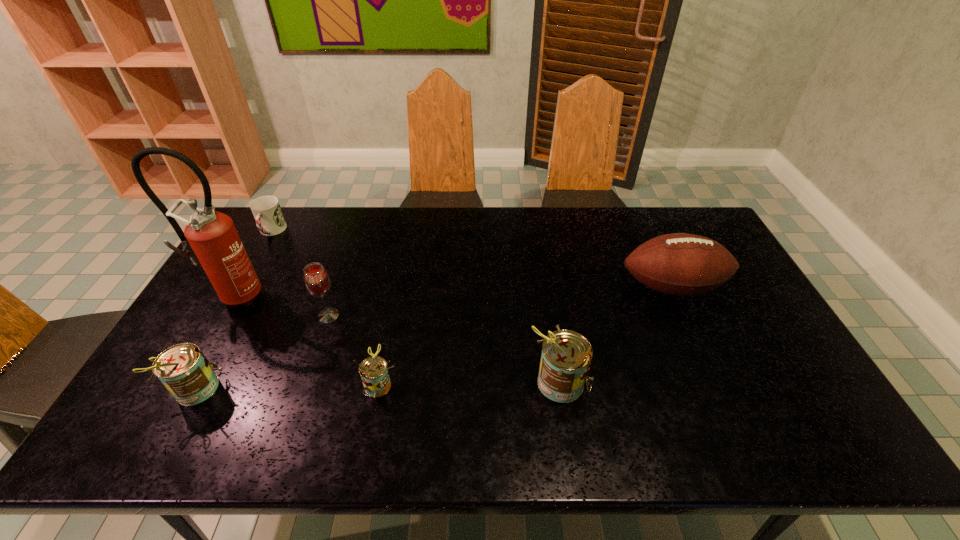
The height and width of the screenshot is (540, 960). I want to click on the closest can to the wineglass, so click(x=373, y=370).

Locate which can ranks third in proximity to the football (American). Please provide its 2D coordinates. Your answer should be formatted as a tuple, i.e. [(x, y)], where the tuple contains the x and y coordinates of a point satisfying the conditions above.

[(184, 370)]

You are a GUI agent. You are given a task and a screenshot of the screen. Output one action in this format:
    pyautogui.click(x=<x>, y=<y>)
    Task: Click on the blank area in the image that satisfies the following two spatial constraints: 1. at the nozzle of the fourth object from left to right; 2. on the left side of the fire extinguisher
    The width and height of the screenshot is (960, 540).
    Given the screenshot: What is the action you would take?
    pyautogui.click(x=225, y=316)

This screenshot has width=960, height=540. What are the coordinates of `free spot that satisfies the following two spatial constraints: 1. at the nozzle of the tallest object; 2. on the left side of the rightmost can` in the screenshot? It's located at (187, 382).

Find the location of a particular element. The width and height of the screenshot is (960, 540). free spot that satisfies the following two spatial constraints: 1. at the nozzle of the tallest object; 2. on the left side of the fourth object from right to left is located at coordinates (225, 316).

Locate an element on the screen. free space that satisfies the following two spatial constraints: 1. on the back side of the rightmost object; 2. on the left side of the second can from left to right is located at coordinates (397, 287).

Identify the location of free space that satisfies the following two spatial constraints: 1. on the handle side of the cup; 2. on the left side of the rightmost can. The height and width of the screenshot is (540, 960). (186, 382).